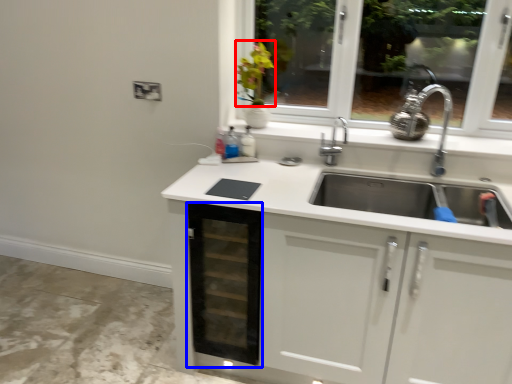
Question: Which object appears farthest to the camera in this image, flower (highlighted by a red box) or drawer (highlighted by a blue box)?

Choices:
 (A) flower
 (B) drawer

Answer: (A)